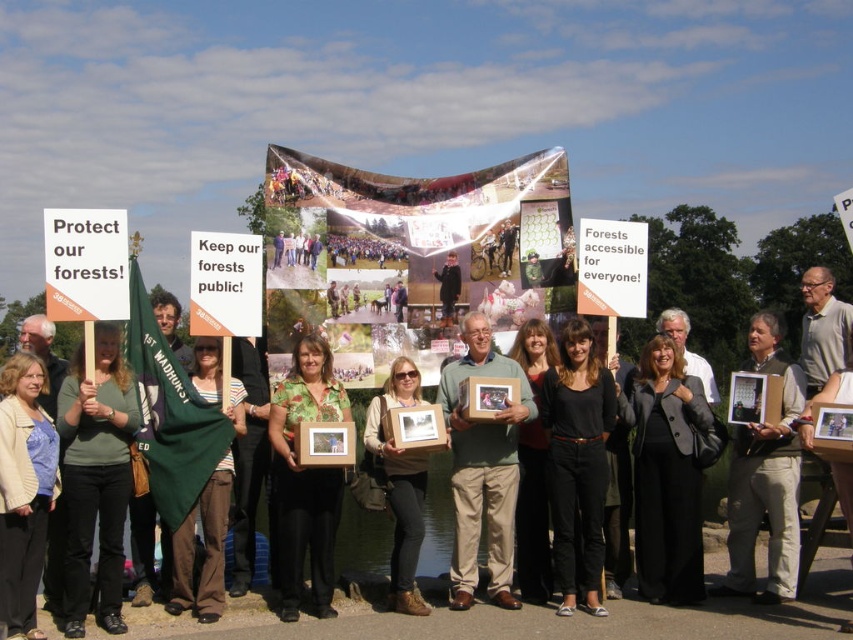
Question: Is green fabric flag at center positioned at the back of black cotton pants at center?

Choices:
 (A) yes
 (B) no

Answer: (A)

Question: Which of the following is the closest to the observer?

Choices:
 (A) green fabric flag at left
 (B) green floral shirt at center

Answer: (A)

Question: Is green floral shirt at center positioned behind dark gray suit at center?

Choices:
 (A) yes
 (B) no

Answer: (B)

Question: Which of these objects is positioned farthest from the khaki cotton vest at center?

Choices:
 (A) light beige sweater at center
 (B) black fabric coat at center
 (C) green fabric flag at left
 (D) black cotton pants at center

Answer: (A)

Question: Is khaki cotton vest at center positioned behind dark gray suit at center?

Choices:
 (A) yes
 (B) no

Answer: (B)

Question: Among these points, which one is nearest to the camera?

Choices:
 (A) (779, 454)
 (B) (650, 572)
 (C) (467, 474)

Answer: (B)